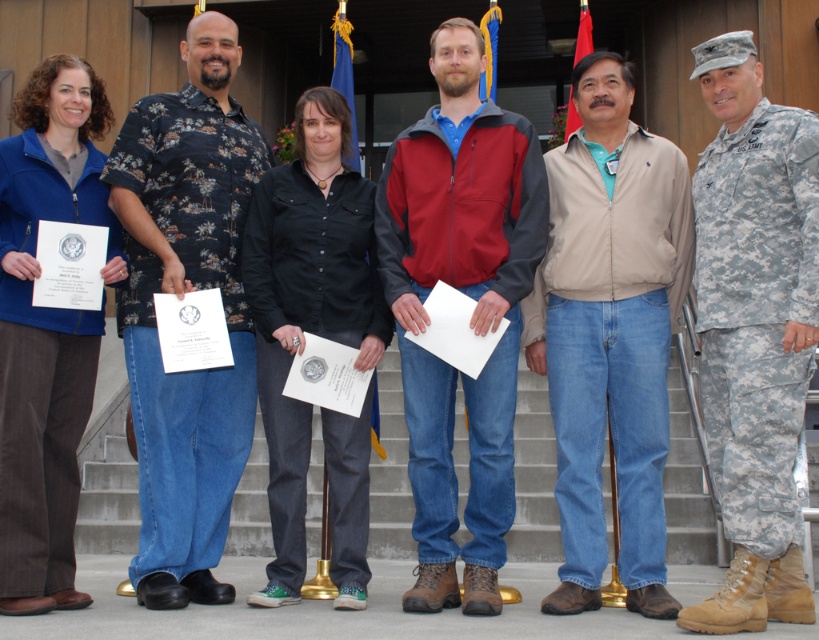
Does floral shirt at center have a lesser height compared to camouflage fabric uniform at right?

No.

Can you confirm if floral shirt at center is positioned to the left of camouflage fabric uniform at right?

Correct, you'll find floral shirt at center to the left of camouflage fabric uniform at right.

Between point (238, 120) and point (777, 420), which one is positioned in front?

Point (777, 420) is in front.

You are a GUI agent. You are given a task and a screenshot of the screen. Output one action in this format:
    pyautogui.click(x=<x>, y=<y>)
    Task: Click on the floral shirt at center
    The height and width of the screenshot is (640, 819).
    Given the screenshot: What is the action you would take?
    pyautogui.click(x=179, y=298)

Between point (550, 371) and point (175, 108), which one is positioned behind?

The point (175, 108) is behind.

Between beige cotton jacket at center and floral shirt at center, which one appears on the right side from the viewer's perspective?

From the viewer's perspective, beige cotton jacket at center appears more on the right side.

Between point (675, 148) and point (210, 19), which one is positioned in front?

Point (675, 148) is in front.

You are a GUI agent. You are given a task and a screenshot of the screen. Output one action in this format:
    pyautogui.click(x=<x>, y=<y>)
    Task: Click on the beige cotton jacket at center
    The height and width of the screenshot is (640, 819).
    Given the screenshot: What is the action you would take?
    pyautogui.click(x=609, y=332)

Does beige cotton jacket at center come behind black cotton shirt at center?

No.

Is beige cotton jacket at center to the left of black cotton shirt at center from the viewer's perspective?

No, beige cotton jacket at center is not to the left of black cotton shirt at center.

Measure the distance between point (627,484) and camera.

Point (627,484) is 22.02 feet from camera.

You are a GUI agent. You are given a task and a screenshot of the screen. Output one action in this format:
    pyautogui.click(x=<x>, y=<y>)
    Task: Click on the beige cotton jacket at center
    This screenshot has height=640, width=819.
    Given the screenshot: What is the action you would take?
    click(x=609, y=332)